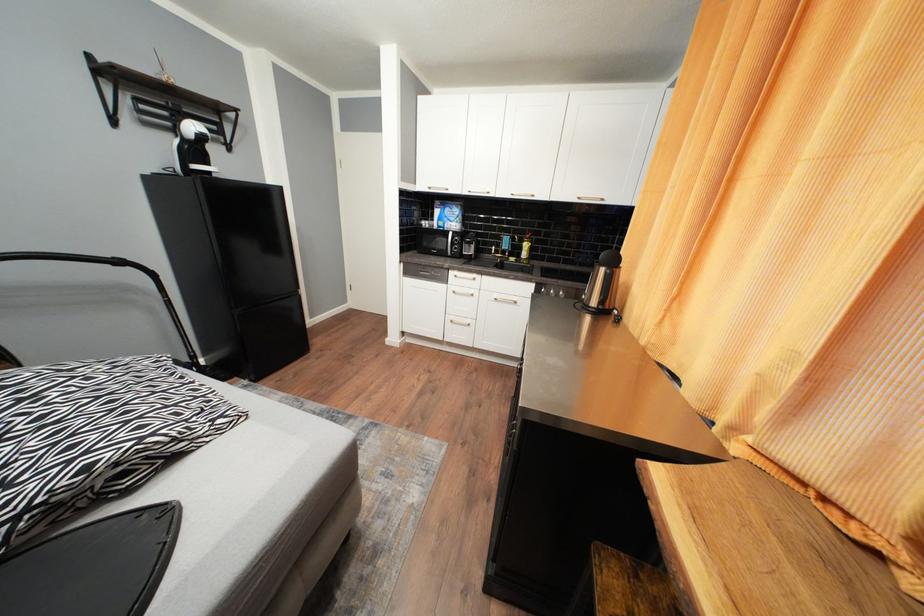
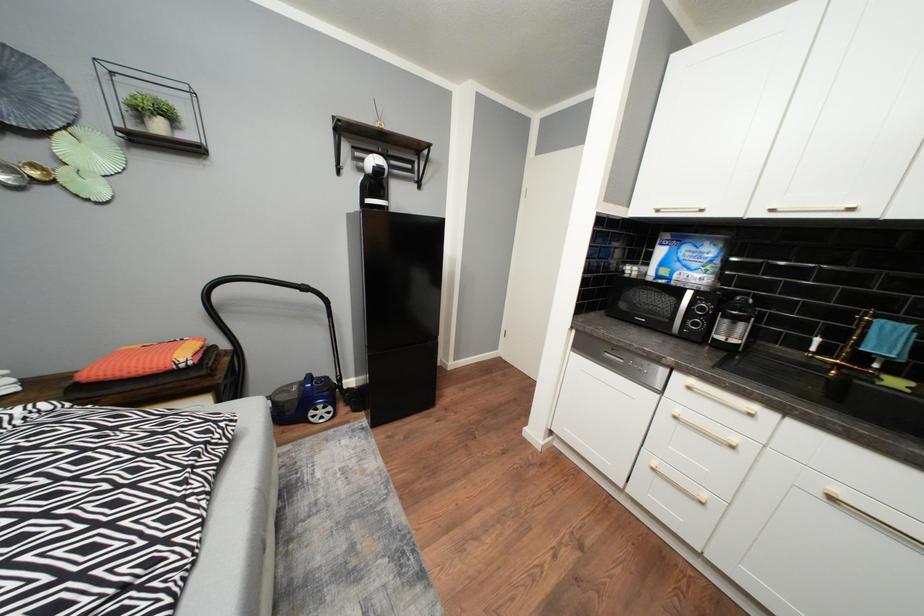
Question: The camera is either moving clockwise (left) or counter-clockwise (right) around the object. The first image is from the beginning of the video and the second image is from the end. Is the camera moving left or right when shooting the video?

Choices:
 (A) Left
 (B) Right

Answer: (B)